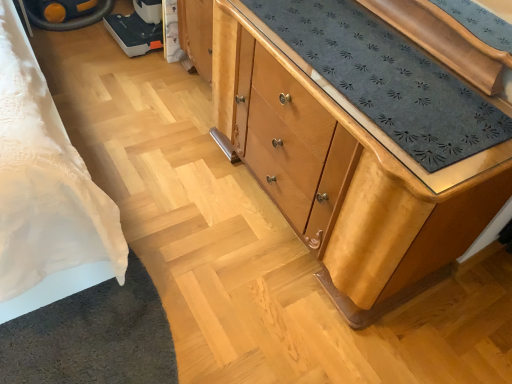
Locate an element on the screen. This screenshot has width=512, height=384. free spot in front of light brown wood chest of drawers at center is located at coordinates (293, 312).